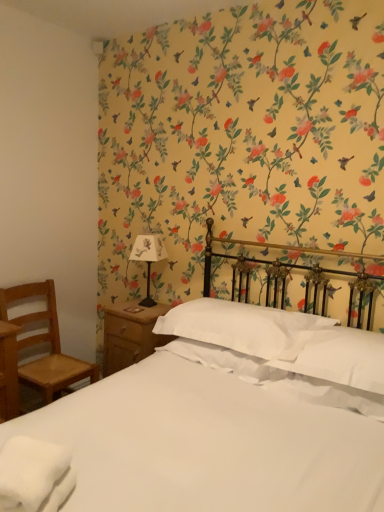
Identify the location of white soft pillow at center, the first pillow in the right-to-left sequence. This screenshot has width=384, height=512. (338, 357).

In order to face white soft pillow at center, the first pillow in the right-to-left sequence, should I rotate leftwards or rightwards?

You should look right and rotate roughly 18.748 degrees.

Describe the element at coordinates (33, 474) in the screenshot. This screenshot has width=384, height=512. I see `white soft towel at lower left` at that location.

Measure the distance between white soft towel at lower left and camera.

A distance of 1.00 meters exists between white soft towel at lower left and camera.

The width and height of the screenshot is (384, 512). What do you see at coordinates (44, 342) in the screenshot? I see `wooden chair at left` at bounding box center [44, 342].

This screenshot has width=384, height=512. What do you see at coordinates (194, 452) in the screenshot?
I see `white satin bed at center` at bounding box center [194, 452].

At what (x,y) coordinates should I click in order to perform the action: click on wooden nightstand at lower left. Please return your answer as a coordinate pair (x, y). Looking at the image, I should click on (130, 334).

How much distance is there between white soft towel at lower left and wooden nightstand at lower left?

A distance of 1.35 meters exists between white soft towel at lower left and wooden nightstand at lower left.

Does white soft towel at lower left appear on the right side of wooden nightstand at lower left?

In fact, white soft towel at lower left is to the left of wooden nightstand at lower left.

Which is correct: white soft towel at lower left is inside wooden nightstand at lower left, or outside of it?

white soft towel at lower left is not enclosed by wooden nightstand at lower left.

Is point (52, 447) less distant than point (151, 344)?

Yes, it is.

Which is further, (281, 336) or (360, 339)?

The point (281, 336) is farther.

Is white soft pillow at center, which ranks as the 2th pillow in left-to-right order, a part of white soft pillow at center, the 1th pillow when ordered from left to right?

No, white soft pillow at center, which ranks as the 2th pillow in left-to-right order, is not inside white soft pillow at center, the 1th pillow when ordered from left to right.

From a real-world perspective, is white soft pillow at center, the 2th pillow positioned from the right, positioned over white soft pillow at center, the first pillow in the right-to-left sequence, based on gravity?

No, from a real-world perspective, white soft pillow at center, the 2th pillow positioned from the right, is not on top of white soft pillow at center, the first pillow in the right-to-left sequence.

Is white soft pillow at center, the 1th pillow when ordered from left to right, looking in the opposite direction of white soft pillow at center, which ranks as the 2th pillow in left-to-right order?

That's not correct — white soft pillow at center, the 1th pillow when ordered from left to right, is not looking away from white soft pillow at center, which ranks as the 2th pillow in left-to-right order.

You are a GUI agent. You are given a task and a screenshot of the screen. Output one action in this format:
    pyautogui.click(x=<x>, y=<y>)
    Task: Click on the chair that is below the white soft towel at lower left (from the image's perspective)
    
    Given the screenshot: What is the action you would take?
    pyautogui.click(x=44, y=342)

Is wooden chair at left facing towards white soft towel at lower left?

No, wooden chair at left does not turn towards white soft towel at lower left.

From the image's perspective, between wooden chair at left and white soft towel at lower left, who is located below?

wooden chair at left is shown below in the image.

Does wooden chair at left have a larger size compared to white soft towel at lower left?

Yes.

Could you tell me if white satin bed at center is turned towards white soft pillow at center, the 1th pillow when ordered from left to right?

No, white satin bed at center is not oriented towards white soft pillow at center, the 1th pillow when ordered from left to right.

What's the angular difference between white satin bed at center and white soft pillow at center, the 1th pillow when ordered from left to right,'s facing directions?

They differ by 0.00037 degrees in their facing directions.

Does white satin bed at center come in front of white soft pillow at center, the 1th pillow when ordered from left to right?

Yes.

Is white satin bed at center in contact with white soft pillow at center, the 2th pillow positioned from the right?

There is a gap between white satin bed at center and white soft pillow at center, the 2th pillow positioned from the right.

Locate an element on the screen. nightstand to the right of wooden chair at left is located at coordinates (130, 334).

From a real-world perspective, is wooden nightstand at lower left under wooden chair at left?

No.

Can you confirm if wooden nightstand at lower left is thinner than wooden chair at left?

Correct, the width of wooden nightstand at lower left is less than that of wooden chair at left.

What's the angular difference between wooden nightstand at lower left and wooden chair at left's facing directions?

There is a 89.6-degree angle between the facing directions of wooden nightstand at lower left and wooden chair at left.

Is white paper lampshade at upper left facing towards white soft towel at lower left?

No, white paper lampshade at upper left is not turned towards white soft towel at lower left.

Consider the image. Which is more to the right, white paper lampshade at upper left or white soft towel at lower left?

From the viewer's perspective, white paper lampshade at upper left appears more on the right side.

Which is farther from the camera, (x=151, y=241) or (x=17, y=458)?

The point (x=151, y=241) is more distant.

Which is nearer, (x=55, y=300) or (x=135, y=244)?

Point (x=55, y=300) is positioned farther from the camera compared to point (x=135, y=244).

Does wooden chair at left have a lesser height compared to white paper lampshade at upper left?

No, wooden chair at left is not shorter than white paper lampshade at upper left.

How many degrees apart are the facing directions of wooden chair at left and white paper lampshade at upper left?

85.7 degrees.

Locate an element on the screen. This screenshot has width=384, height=512. bedside lamp lying above the wooden chair at left (from the image's perspective) is located at coordinates (148, 258).

Find the location of a particular element. This screenshot has height=512, width=384. cloth that is below the wooden nightstand at lower left (from the image's perspective) is located at coordinates (33, 474).

This screenshot has width=384, height=512. I want to click on pillow located behind the white soft pillow at center, the first pillow in the right-to-left sequence, so click(x=243, y=327).

Which object lies further to the anchor point wooden chair at left, white satin bed at center or white paper lampshade at upper left?

Based on the image, white satin bed at center appears to be further to wooden chair at left.

From the image, which object appears to be nearer to white satin bed at center, white soft pillow at center, which ranks as the 2th pillow in left-to-right order, or white soft pillow at center, the 2th pillow positioned from the right?

Among the two, white soft pillow at center, which ranks as the 2th pillow in left-to-right order, is located nearer to white satin bed at center.

When comparing their distances from white satin bed at center, does white soft towel at lower left or wooden chair at left seem further?

Among the two, wooden chair at left is located further to white satin bed at center.

Looking at the image, which one is located further to white soft towel at lower left, wooden nightstand at lower left or white paper lampshade at upper left?

white paper lampshade at upper left is further to white soft towel at lower left.

Which object lies further to the anchor point white soft towel at lower left, white soft pillow at center, which ranks as the 2th pillow in left-to-right order, or white soft pillow at center, the 2th pillow positioned from the right?

white soft pillow at center, the 2th pillow positioned from the right, is further to white soft towel at lower left.

When comparing their distances from white soft towel at lower left, does white satin bed at center or white paper lampshade at upper left seem further?

Based on the image, white paper lampshade at upper left appears to be further to white soft towel at lower left.

Which object lies further to the anchor point white satin bed at center, white paper lampshade at upper left or wooden chair at left?

white paper lampshade at upper left.

Looking at this image, which object lies further to the anchor point white paper lampshade at upper left, wooden nightstand at lower left or white soft towel at lower left?

Based on the image, white soft towel at lower left appears to be further to white paper lampshade at upper left.

The image size is (384, 512). In order to click on nightstand located between white soft towel at lower left and white paper lampshade at upper left in the depth direction in this screenshot , I will do `click(130, 334)`.

The height and width of the screenshot is (512, 384). In order to click on bedside lamp between wooden chair at left and white soft pillow at center, the 2th pillow positioned from the right, from left to right in this screenshot , I will do `click(148, 258)`.

The image size is (384, 512). Identify the location of pillow positioned between white soft pillow at center, which ranks as the 2th pillow in left-to-right order, and white paper lampshade at upper left from near to far. (243, 327).

The height and width of the screenshot is (512, 384). What are the coordinates of `pillow between wooden nightstand at lower left and white soft pillow at center, the first pillow in the right-to-left sequence` in the screenshot? It's located at (243, 327).